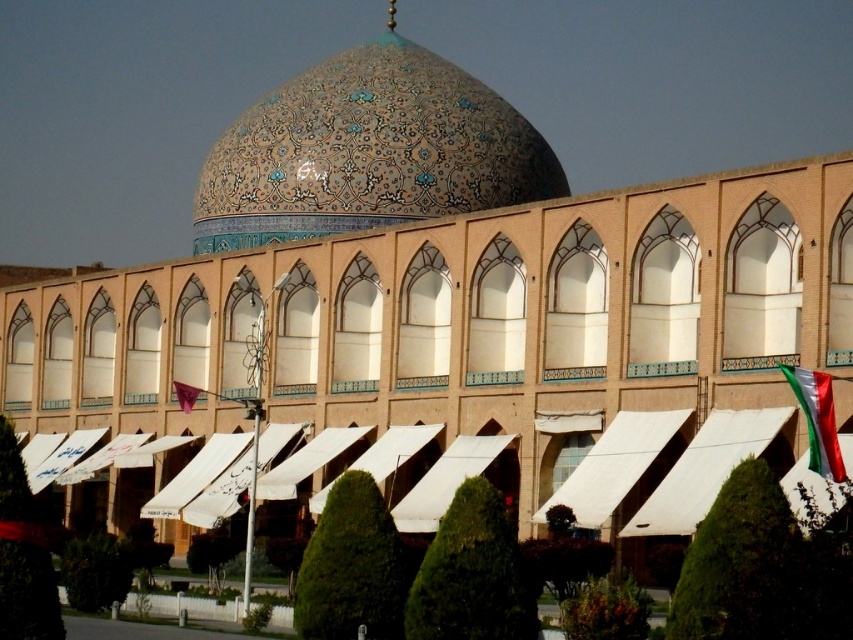
Is point (425, 202) positioned in front of point (817, 444)?

No, it is behind (817, 444).

What do you see at coordinates (367, 150) in the screenshot?
I see `glazed ceramic dome at center` at bounding box center [367, 150].

Find the location of `glazed ceramic dome at center`. glazed ceramic dome at center is located at coordinates (367, 150).